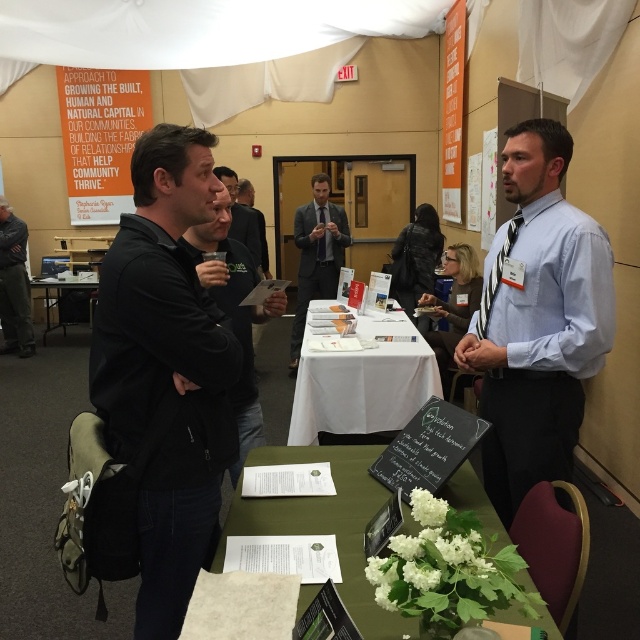
Question: Where is black matte jacket at left located in relation to matte gray suit at center in the image?

Choices:
 (A) below
 (B) above

Answer: (A)

Question: Among these points, which one is nearest to the camera?

Choices:
 (A) (504, 269)
 (B) (234, 177)

Answer: (A)

Question: Can you confirm if light blue shirt at center is bigger than green fabric table at center?

Choices:
 (A) no
 (B) yes

Answer: (B)

Question: Among these objects, which one is nearest to the camera?

Choices:
 (A) black shirt at center
 (B) black softshell jacket at center

Answer: (B)

Question: Which object appears farthest from the camera in this image?

Choices:
 (A) black shirt at center
 (B) green fabric table at center
 (C) white cloth table at center
 (D) black leather jacket at left

Answer: (D)

Question: Does white plastic table at center appear under black shirt at center?

Choices:
 (A) no
 (B) yes

Answer: (B)